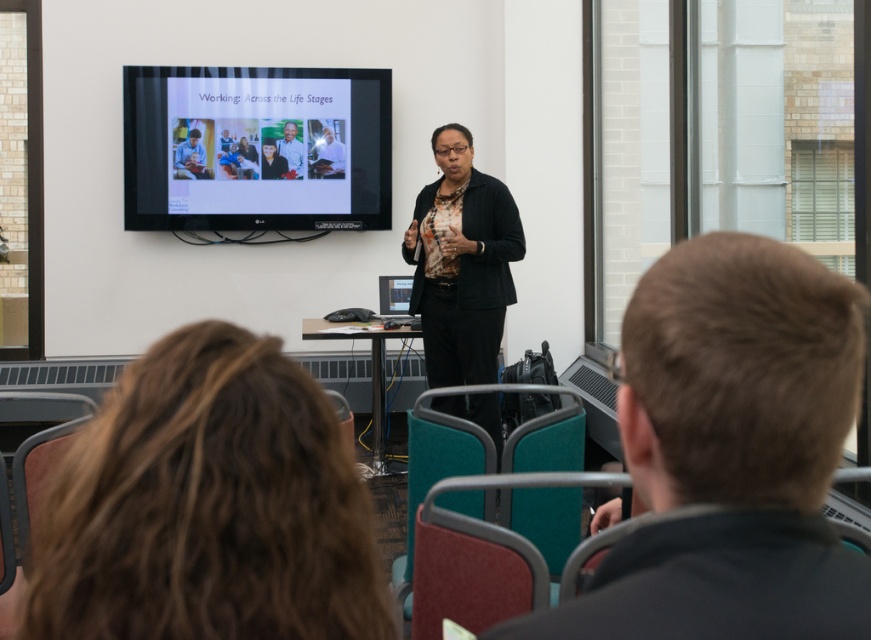
Who is more distant from viewer, (321, 403) or (181, 145)?

Positioned behind is point (181, 145).

Can you confirm if brown hair at lower left is positioned to the right of matte black laptop at upper left?

Indeed, brown hair at lower left is positioned on the right side of matte black laptop at upper left.

This screenshot has height=640, width=871. What do you see at coordinates (207, 506) in the screenshot?
I see `brown hair at lower left` at bounding box center [207, 506].

Locate an element on the screen. The width and height of the screenshot is (871, 640). brown hair at lower left is located at coordinates (207, 506).

Does brown hair at lower left have a smaller size compared to green fabric shirt at center?

Actually, brown hair at lower left might be larger than green fabric shirt at center.

Who is more forward, (194,435) or (273,157)?

Point (194,435)

Image resolution: width=871 pixels, height=640 pixels. What are the coordinates of `brown hair at lower left` in the screenshot? It's located at (207, 506).

Where is `matte black screen at upper center`? matte black screen at upper center is located at coordinates (255, 147).

Does matte black screen at upper center lie behind light brown wood frame at center?

No.

Between point (221, 209) and point (288, 132), which one is positioned behind?

The point (221, 209) is behind.

You are a GUI agent. You are given a task and a screenshot of the screen. Output one action in this format:
    pyautogui.click(x=<x>, y=<y>)
    Task: Click on the matte black screen at upper center
    This screenshot has width=871, height=640.
    Given the screenshot: What is the action you would take?
    pyautogui.click(x=255, y=147)